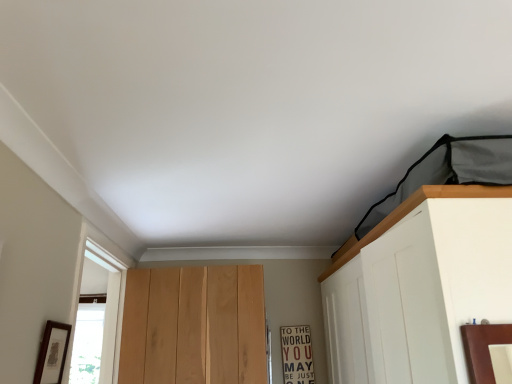
Question: Should I look upward or downward to see matte black picture frame at lower left?

Choices:
 (A) up
 (B) down

Answer: (B)

Question: Considering the relative sizes of matte black picture frame at lower left and wooden sign at center in the image provided, is matte black picture frame at lower left smaller than wooden sign at center?

Choices:
 (A) no
 (B) yes

Answer: (B)

Question: Is matte black picture frame at lower left at the left side of wooden sign at center?

Choices:
 (A) no
 (B) yes

Answer: (B)

Question: Is matte black picture frame at lower left bigger than wooden sign at center?

Choices:
 (A) no
 (B) yes

Answer: (A)

Question: From the image's perspective, is matte black picture frame at lower left on wooden sign at center?

Choices:
 (A) no
 (B) yes

Answer: (B)

Question: Can you confirm if matte black picture frame at lower left is wider than wooden sign at center?

Choices:
 (A) no
 (B) yes

Answer: (A)

Question: Can you confirm if matte black picture frame at lower left is taller than wooden sign at center?

Choices:
 (A) yes
 (B) no

Answer: (B)

Question: Can you confirm if wooden sign at center is bigger than matte black picture frame at lower left?

Choices:
 (A) yes
 (B) no

Answer: (A)

Question: From a real-world perspective, is wooden sign at center positioned over matte black picture frame at lower left based on gravity?

Choices:
 (A) yes
 (B) no

Answer: (B)

Question: Is wooden sign at center oriented away from matte black picture frame at lower left?

Choices:
 (A) no
 (B) yes

Answer: (A)

Question: Is wooden sign at center not near matte black picture frame at lower left?

Choices:
 (A) yes
 (B) no

Answer: (A)

Question: Can you confirm if wooden sign at center is shorter than matte black picture frame at lower left?

Choices:
 (A) no
 (B) yes

Answer: (A)

Question: Is wooden sign at center located outside matte black picture frame at lower left?

Choices:
 (A) no
 (B) yes

Answer: (B)

Question: Is matte black picture frame at lower left to the left or to the right of wooden sign at center in the image?

Choices:
 (A) right
 (B) left

Answer: (B)